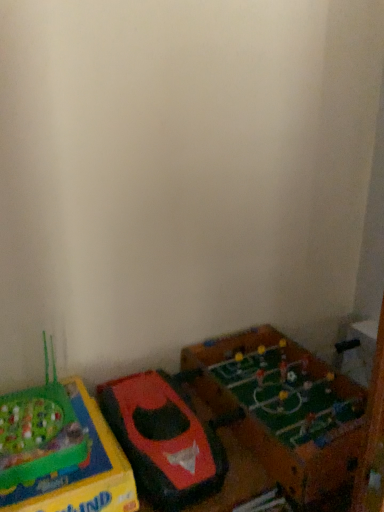
Question: Considering the relative sizes of green matte foosball table at lower right, which is the third toy in left-to-right order, and green plastic game at lower left, marked as the 1th toy in a left-to-right arrangement, in the image provided, is green matte foosball table at lower right, which is the third toy in left-to-right order, taller than green plastic game at lower left, marked as the 1th toy in a left-to-right arrangement,?

Choices:
 (A) no
 (B) yes

Answer: (B)

Question: From the image's perspective, is green matte foosball table at lower right, which is the third toy in left-to-right order, located above green plastic game at lower left, marked as the 1th toy in a left-to-right arrangement?

Choices:
 (A) yes
 (B) no

Answer: (A)

Question: Would you say green matte foosball table at lower right, which is the third toy in left-to-right order, contains green plastic game at lower left, which appears as the third toy when viewed from the right?

Choices:
 (A) yes
 (B) no

Answer: (B)

Question: Does green matte foosball table at lower right, the 1th toy in the right-to-left sequence, appear on the right side of green plastic game at lower left, which appears as the third toy when viewed from the right?

Choices:
 (A) yes
 (B) no

Answer: (A)

Question: Does green matte foosball table at lower right, which is the third toy in left-to-right order, touch green plastic game at lower left, which appears as the third toy when viewed from the right?

Choices:
 (A) yes
 (B) no

Answer: (B)

Question: Is green matte foosball table at lower right, which is the third toy in left-to-right order, positioned with its back to green plastic game at lower left, marked as the 1th toy in a left-to-right arrangement?

Choices:
 (A) no
 (B) yes

Answer: (A)

Question: Does green matte foosball table at lower right, which is the third toy in left-to-right order, have a greater height compared to rubberized red toy boat at lower left, acting as the 2th toy starting from the right?

Choices:
 (A) yes
 (B) no

Answer: (A)

Question: Is there a large distance between green matte foosball table at lower right, the 1th toy in the right-to-left sequence, and rubberized red toy boat at lower left, placed as the 2th toy when sorted from left to right?

Choices:
 (A) no
 (B) yes

Answer: (A)

Question: Is the position of green matte foosball table at lower right, which is the third toy in left-to-right order, less distant than that of rubberized red toy boat at lower left, acting as the 2th toy starting from the right?

Choices:
 (A) yes
 (B) no

Answer: (B)

Question: Does green matte foosball table at lower right, the 1th toy in the right-to-left sequence, appear on the left side of rubberized red toy boat at lower left, placed as the 2th toy when sorted from left to right?

Choices:
 (A) yes
 (B) no

Answer: (B)

Question: Can you confirm if green matte foosball table at lower right, the 1th toy in the right-to-left sequence, is positioned to the right of rubberized red toy boat at lower left, acting as the 2th toy starting from the right?

Choices:
 (A) yes
 (B) no

Answer: (A)

Question: From a real-world perspective, does green matte foosball table at lower right, the 1th toy in the right-to-left sequence, sit lower than rubberized red toy boat at lower left, placed as the 2th toy when sorted from left to right?

Choices:
 (A) no
 (B) yes

Answer: (B)

Question: Is rubberized red toy boat at lower left, placed as the 2th toy when sorted from left to right, not inside green plastic game at lower left, marked as the 1th toy in a left-to-right arrangement?

Choices:
 (A) no
 (B) yes

Answer: (B)